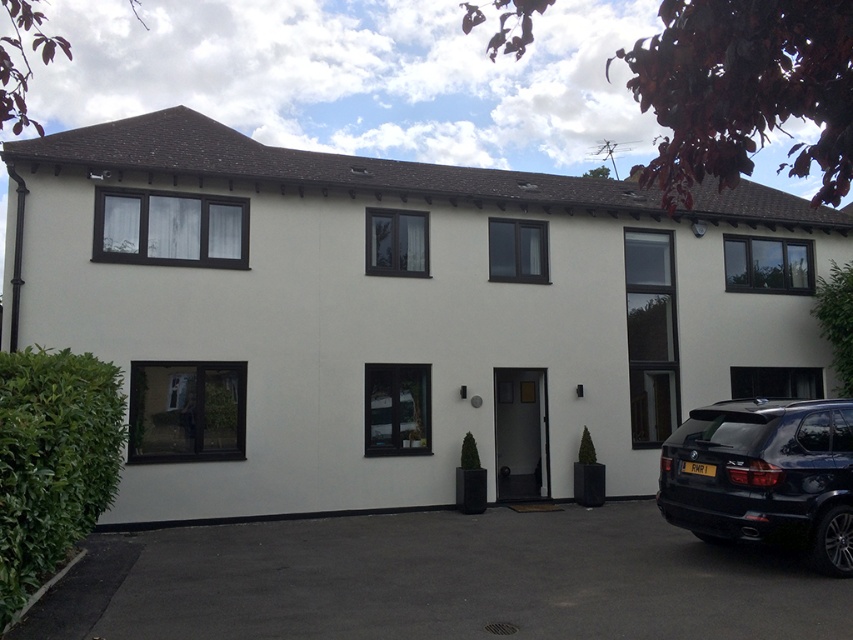
Is black glossy suv at lower right further to camera compared to green leafy bush at lower left?

Yes, it is behind green leafy bush at lower left.

Who is more distant from viewer, [733,477] or [62,420]?

The point [733,477] is behind.

At what (x,y) coordinates should I click in order to perform the action: click on black glossy suv at lower right. Please return your answer as a coordinate pair (x, y). The image size is (853, 640). Looking at the image, I should click on (764, 476).

This screenshot has width=853, height=640. I want to click on black glossy suv at lower right, so click(764, 476).

Is black asphalt driveway at lower center shorter than green leafy bush at lower left?

Yes, black asphalt driveway at lower center is shorter than green leafy bush at lower left.

Which is below, black asphalt driveway at lower center or green leafy bush at lower left?

black asphalt driveway at lower center is lower down.

This screenshot has height=640, width=853. What do you see at coordinates (439, 580) in the screenshot?
I see `black asphalt driveway at lower center` at bounding box center [439, 580].

You are a GUI agent. You are given a task and a screenshot of the screen. Output one action in this format:
    pyautogui.click(x=<x>, y=<y>)
    Task: Click on the black asphalt driveway at lower center
    
    Given the screenshot: What is the action you would take?
    pyautogui.click(x=439, y=580)

Is black asphalt driveway at lower center bigger than black glossy suv at lower right?

Correct, black asphalt driveway at lower center is larger in size than black glossy suv at lower right.

Between black asphalt driveway at lower center and black glossy suv at lower right, which one has less height?

black asphalt driveway at lower center is shorter.

What do you see at coordinates (439, 580) in the screenshot? The width and height of the screenshot is (853, 640). I see `black asphalt driveway at lower center` at bounding box center [439, 580].

This screenshot has height=640, width=853. I want to click on black asphalt driveway at lower center, so click(439, 580).